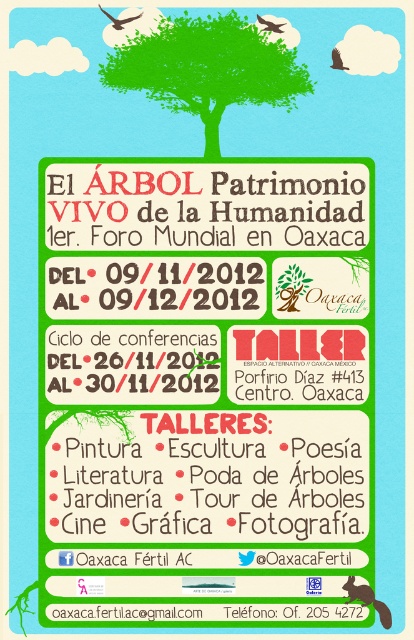
You are looking at the promotional poster for the event. Which object is closer to you, the viewer, between the matte red text at center and the green matte tree at upper center?

The matte red text at center is closer to the viewer than the green matte tree at upper center.